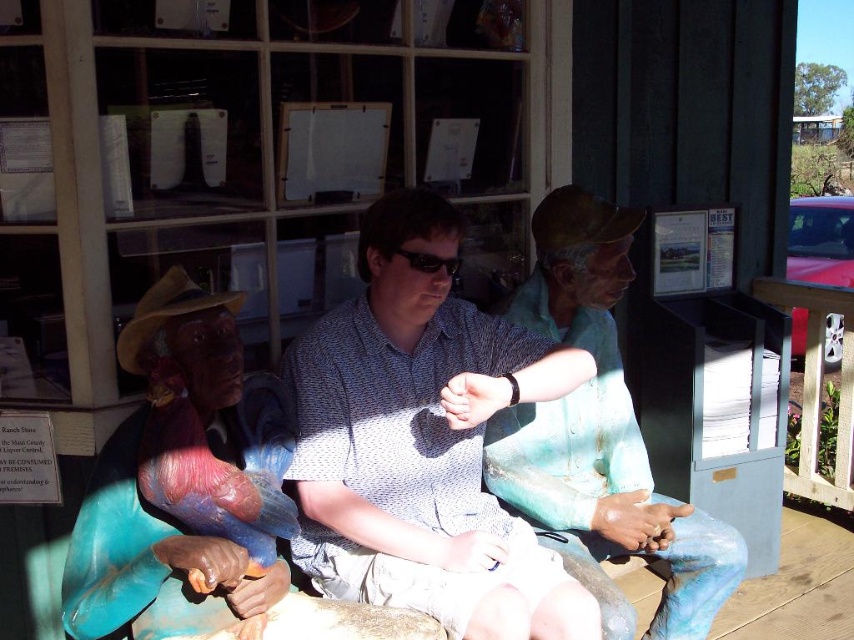
Question: Is blue-green painted statue at center further to the viewer compared to matte green statue at center?

Choices:
 (A) no
 (B) yes

Answer: (A)

Question: Is blue-green painted statue at center smaller than matte green statue at center?

Choices:
 (A) yes
 (B) no

Answer: (A)

Question: Is blue-green painted statue at center bigger than matte green statue at center?

Choices:
 (A) no
 (B) yes

Answer: (A)